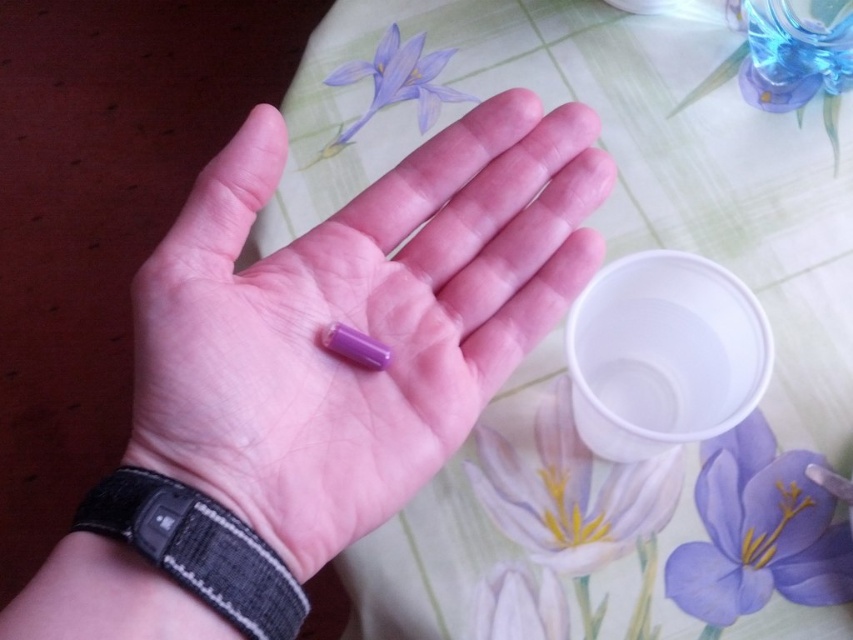
Is transparent plastic cup at lower right shorter than matte purple flower at upper center?

In fact, transparent plastic cup at lower right may be taller than matte purple flower at upper center.

Who is positioned more to the right, transparent plastic cup at lower right or matte purple flower at upper center?

Positioned to the right is transparent plastic cup at lower right.

This screenshot has width=853, height=640. What do you see at coordinates (663, 353) in the screenshot?
I see `transparent plastic cup at lower right` at bounding box center [663, 353].

Locate an element on the screen. transparent plastic cup at lower right is located at coordinates (663, 353).

Does purple matte flower at center appear on the right side of black fabric wristband at lower left?

Indeed, purple matte flower at center is positioned on the right side of black fabric wristband at lower left.

Measure the distance between purple matte flower at center and camera.

purple matte flower at center and camera are 55.39 centimeters apart from each other.

Where is `purple matte flower at center`? purple matte flower at center is located at coordinates (758, 532).

Between floral-patterned fabric at center and transparent plastic cup at lower right, which one appears on the left side from the viewer's perspective?

Positioned to the left is floral-patterned fabric at center.

Between point (763, 429) and point (759, 368), which one is positioned behind?

Positioned behind is point (763, 429).

Is point (380, 538) behind point (575, 420)?

No, it is not.

Identify the location of floral-patterned fabric at center. This screenshot has width=853, height=640. (561, 324).